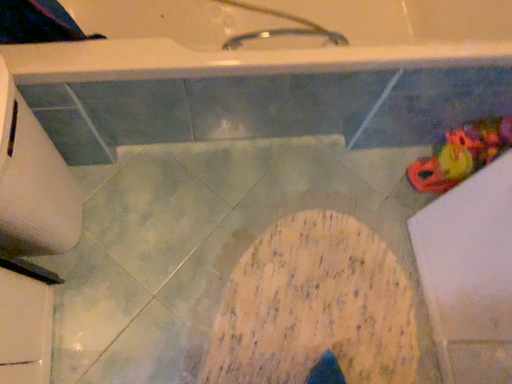
What do you see at coordinates (461, 155) in the screenshot? I see `rubber duck at right` at bounding box center [461, 155].

What are the coordinates of `rubber duck at right` in the screenshot? It's located at (461, 155).

Measure the distance between point [69,216] and camera.

Point [69,216] is 1.14 meters from camera.

What do you see at coordinates (35, 188) in the screenshot?
I see `white matte toilet paper at left` at bounding box center [35, 188].

The height and width of the screenshot is (384, 512). I want to click on white matte toilet paper at left, so click(x=35, y=188).

Find the location of a particular element. The width and height of the screenshot is (512, 384). rubber duck at right is located at coordinates (461, 155).

Based on their positions, is rubber duck at right located to the left or right of white matte toilet paper at left?

Clearly, rubber duck at right is on the right of white matte toilet paper at left in the image.

Is rubber duck at right in front of or behind white matte toilet paper at left in the image?

rubber duck at right is behind white matte toilet paper at left.

Is point (415, 175) closer to camera compared to point (64, 243)?

No, (415, 175) is behind (64, 243).

From the image's perspective, relative to white matte toilet paper at left, is rubber duck at right above or below?

rubber duck at right is above white matte toilet paper at left.

From a real-world perspective, which object rests below the other?

In real-world perspective, rubber duck at right is lower.

Is rubber duck at right thinner than white matte toilet paper at left?

Correct, the width of rubber duck at right is less than that of white matte toilet paper at left.

Based on the photo, considering the sizes of rubber duck at right and white matte toilet paper at left in the image, is rubber duck at right taller or shorter than white matte toilet paper at left?

Clearly, rubber duck at right is shorter compared to white matte toilet paper at left.

Who is smaller, rubber duck at right or white matte toilet paper at left?

rubber duck at right.

Is rubber duck at right located outside white matte toilet paper at left?

Indeed, rubber duck at right is completely outside white matte toilet paper at left.

Are rubber duck at right and white matte toilet paper at left far apart?

Yes.

Does rubber duck at right turn towards white matte toilet paper at left?

Yes, rubber duck at right is facing white matte toilet paper at left.

Identify the location of toy that appears below the white matte toilet paper at left (from a real-world perspective). (461, 155).

Is white matte toilet paper at left to the left or to the right of rubber duck at right in the image?

white matte toilet paper at left is to the left of rubber duck at right.

Between white matte toilet paper at left and rubber duck at right, which one is positioned in front?

white matte toilet paper at left is in front.

Which is in front, point (31, 180) or point (448, 181)?

Point (31, 180)

From the image's perspective, is white matte toilet paper at left located above or below rubber duck at right?

Clearly, from the image's perspective, white matte toilet paper at left is below rubber duck at right.

From a real-world perspective, which object rests below the other?

rubber duck at right, from a real-world perspective.

Between white matte toilet paper at left and rubber duck at right, which one has larger width?

white matte toilet paper at left.

Does white matte toilet paper at left have a greater height compared to rubber duck at right?

Yes, white matte toilet paper at left is taller than rubber duck at right.

Which of these two, white matte toilet paper at left or rubber duck at right, is bigger?

white matte toilet paper at left.

Is white matte toilet paper at left positioned beyond the bounds of rubber duck at right?

Yes.

Is white matte toilet paper at left far away from rubber duck at right?

Absolutely, white matte toilet paper at left is distant from rubber duck at right.

Does white matte toilet paper at left turn towards rubber duck at right?

Yes, white matte toilet paper at left is turned towards rubber duck at right.

In the image, there is a white matte toilet paper at left. Identify the location of toy above it (from the image's perspective). The width and height of the screenshot is (512, 384). (461, 155).

Find the location of `toilet paper lying in front of the rubber duck at right`. toilet paper lying in front of the rubber duck at right is located at coordinates pyautogui.click(x=35, y=188).

Where is `toy above the white matte toilet paper at left (from the image's perspective)`? The width and height of the screenshot is (512, 384). toy above the white matte toilet paper at left (from the image's perspective) is located at coordinates (x=461, y=155).